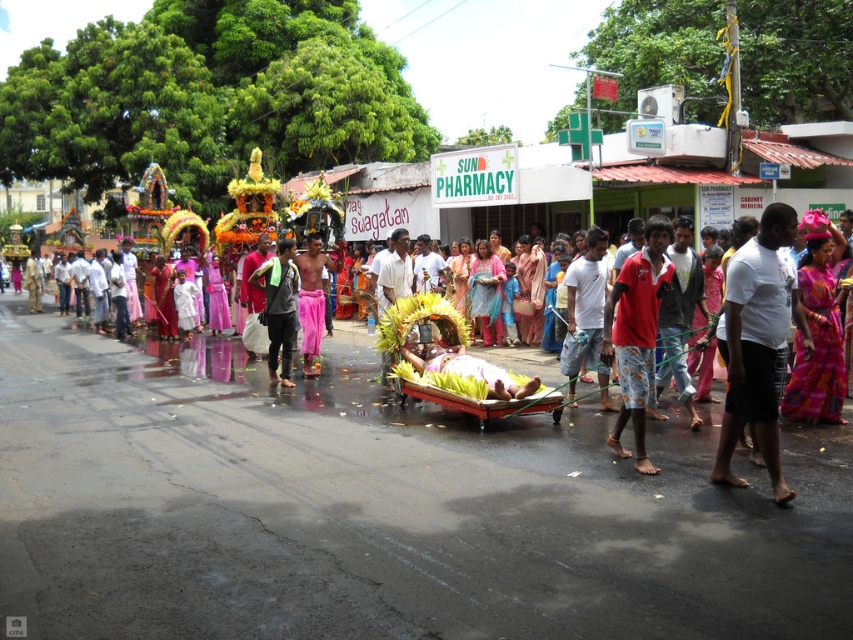
Is white cotton shirt at center positioned in front of green leafy cart at center?

Yes, white cotton shirt at center is closer to the viewer.

Between point (779, 244) and point (463, 333), which one is positioned behind?

Point (463, 333)

The width and height of the screenshot is (853, 640). Find the location of `white cotton shirt at center`. white cotton shirt at center is located at coordinates (757, 342).

Is wooden cart at center positioned behind green leafy bed at center?

Result: No, wooden cart at center is in front of green leafy bed at center.

Can you confirm if wooden cart at center is thinner than green leafy bed at center?

Incorrect, wooden cart at center's width is not less than green leafy bed at center's.

Does point (345, 544) lie behind point (426, 369)?

That is False.

The width and height of the screenshot is (853, 640). In order to click on wooden cart at center in this screenshot , I will do `click(363, 458)`.

Can you confirm if wooden cart at center is taller than dark gray fabric shirt at center?

No.

Which of these two, wooden cart at center or dark gray fabric shirt at center, stands shorter?

wooden cart at center

Does point (845, 433) lie behind point (287, 301)?

No, (845, 433) is closer to viewer.

Locate an element on the screen. The width and height of the screenshot is (853, 640). wooden cart at center is located at coordinates (363, 458).